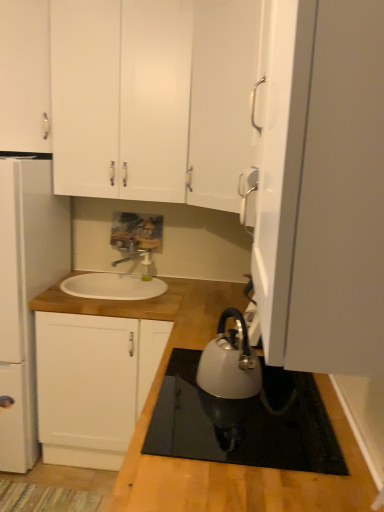
Image resolution: width=384 pixels, height=512 pixels. In order to click on free space that is to the left of satin silver kettle at lower center in this screenshot , I will do [x=180, y=393].